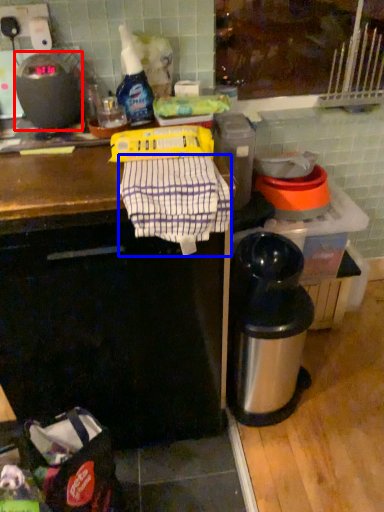
Question: Which object appears closest to the camera in this image, kitchen appliance (highlighted by a red box) or laundry (highlighted by a blue box)?

Choices:
 (A) kitchen appliance
 (B) laundry

Answer: (B)